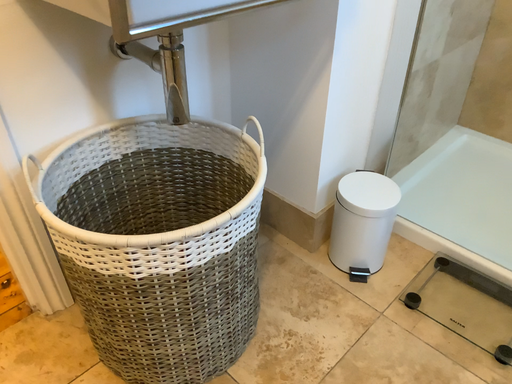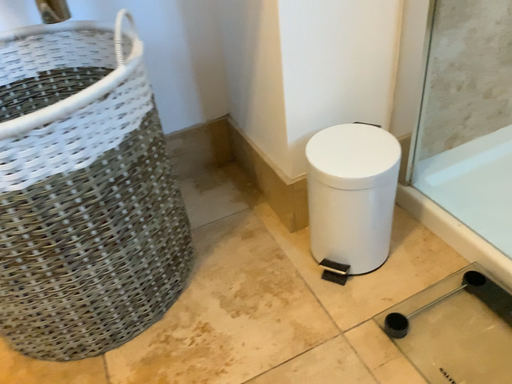
Question: How did the camera likely rotate when shooting the video?

Choices:
 (A) rotated right
 (B) rotated left

Answer: (B)